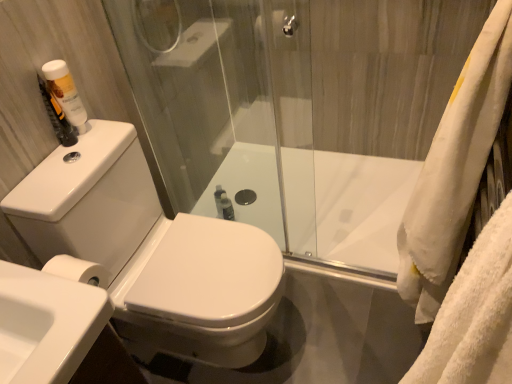
You are a GUI agent. You are given a task and a screenshot of the screen. Output one action in this format:
    pyautogui.click(x=<x>, y=<y>)
    Task: Click on the free point below transparent glass shower door at upper right (from a real-world perspective)
    The image size is (512, 384).
    Given the screenshot: What is the action you would take?
    pyautogui.click(x=343, y=274)